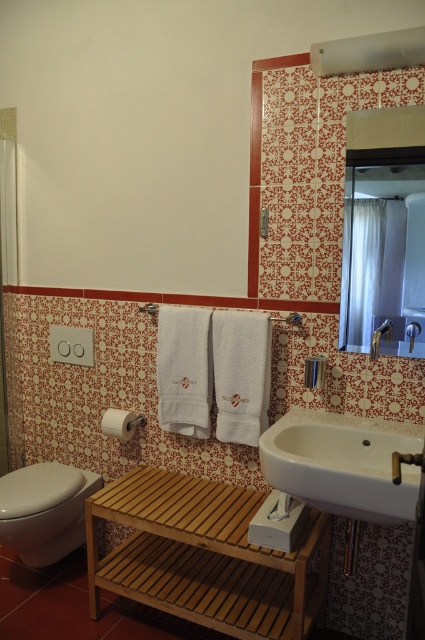
Please look at the bathroom scene. There is a point labeled at coordinates (342, 464). Which object from the list below is located at that point? Choose from the following options. white ceramic sink at center, white toilet with closed lid on left, toilet paper holder with roll adjacent to toilet, dual flush button panel above toilet paper holder, white towels on towel racks at center.

The point at coordinates (342, 464) corresponds to the white ceramic sink at center.

You are a guest in this bathroom and need to wash your hands. You see the wooden stool at lower center and the white ceramic sink at center. Which object should you approach first to reach the sink?

The white ceramic sink at center is behind the wooden stool at lower center, so you should move around or remove the wooden stool at lower center to access the sink.

You are a guest in this bathroom and want to locate the white matte toilet paper at lower left. Where should you look relative to the glossy glass mirror at upper center?

The glossy glass mirror at upper center is located above the white matte toilet paper at lower left, so you should look below the glossy glass mirror at upper center to find the white matte toilet paper at lower left.